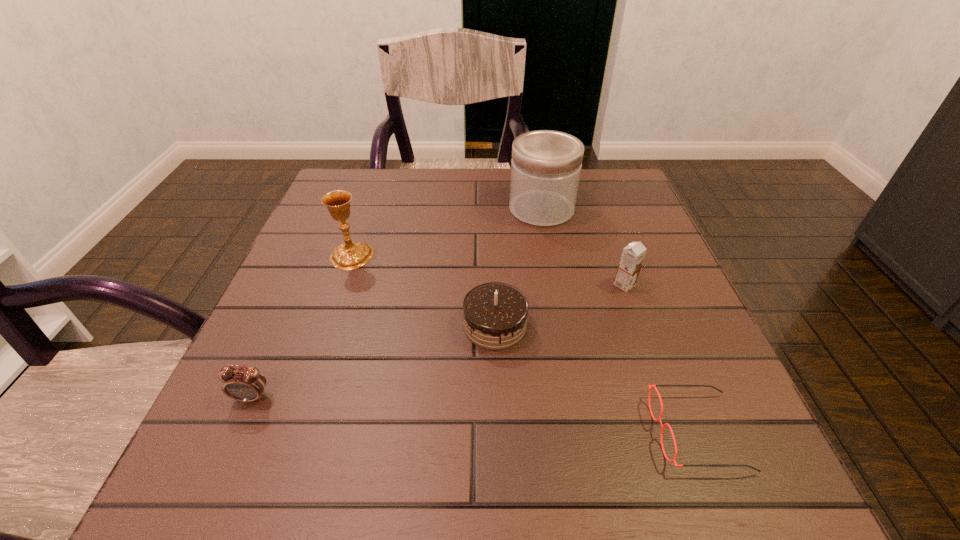
This screenshot has height=540, width=960. I want to click on jar, so click(x=546, y=165).

Where is `the fifth shortest object`? the fifth shortest object is located at coordinates (350, 255).

Where is `the fifth object from right to left`? the fifth object from right to left is located at coordinates (350, 255).

You are a GUI agent. You are given a task and a screenshot of the screen. Output one action in this format:
    pyautogui.click(x=<x>, y=<y>)
    Task: Click on the third farthest object
    The image size is (960, 540).
    Given the screenshot: What is the action you would take?
    pyautogui.click(x=632, y=256)

The image size is (960, 540). What are the coordinates of `chocolate cake` in the screenshot? It's located at (495, 314).

You are a GUI agent. You are given a task and a screenshot of the screen. Output one action in this format:
    pyautogui.click(x=<x>, y=<y>)
    Task: Click on the alarm clock
    
    Given the screenshot: What is the action you would take?
    [246, 384]

Where is `spectacles`? spectacles is located at coordinates (650, 388).

Locate an element on the screen. Image resolution: width=960 pixels, height=540 pixels. vacant space situated 0.240m on the left of the farthest object is located at coordinates (412, 209).

The image size is (960, 540). I want to click on vacant space located 0.330m on the front of the second tallest object, so (299, 411).

I want to click on blank space located on the left of the chocolate milk, so click(574, 285).